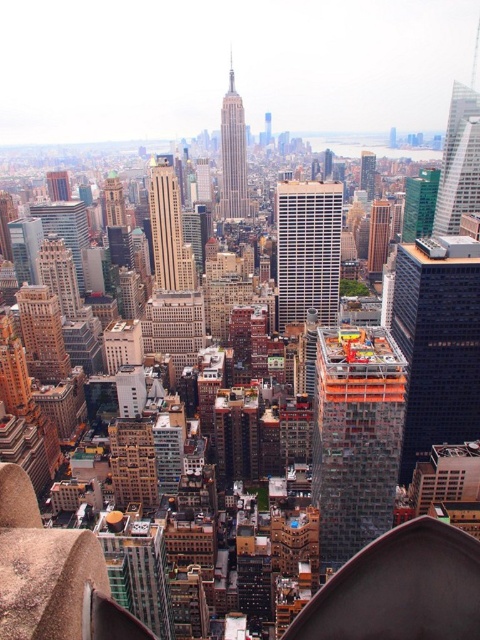
You are standing on a viewing platform in New York City, looking out at the skyline. You notice a point marked at coordinates (437, 342). Which building does this point correspond to?

The point (437, 342) corresponds to the black glass building at center right.